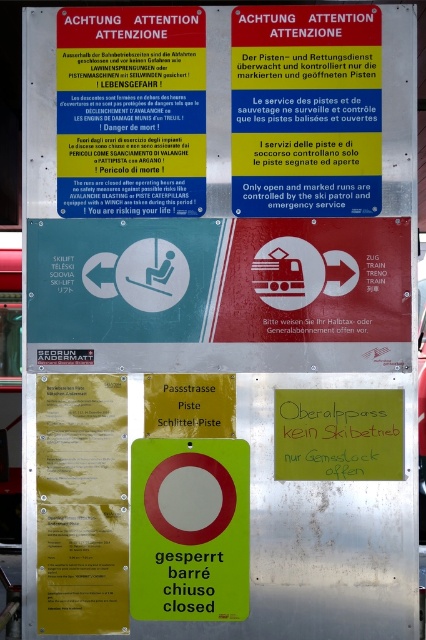
You are standing at the entrance of the ski resort and see the green matte sign at center. If you move 0.1 units to the right along the x axis, will you be closer to the sign?

The green matte sign at center is at point (189,529). Moving 0.1 units to the right along the x axis would increase your x coordinate by 0.1, so your new position would be at x 0.928. Since the sign is at x 0.828, moving right away from it would make you farther from the sign, so no, you would not be closer.

You are a visitor at the ski resort and need to read both the red plastic sign at upper center and the green paper sign at center. Which sign should you look at first if you want to read the larger one?

The red plastic sign at upper center is larger in size than the green paper sign at center, so you should look at the red plastic sign at upper center first.